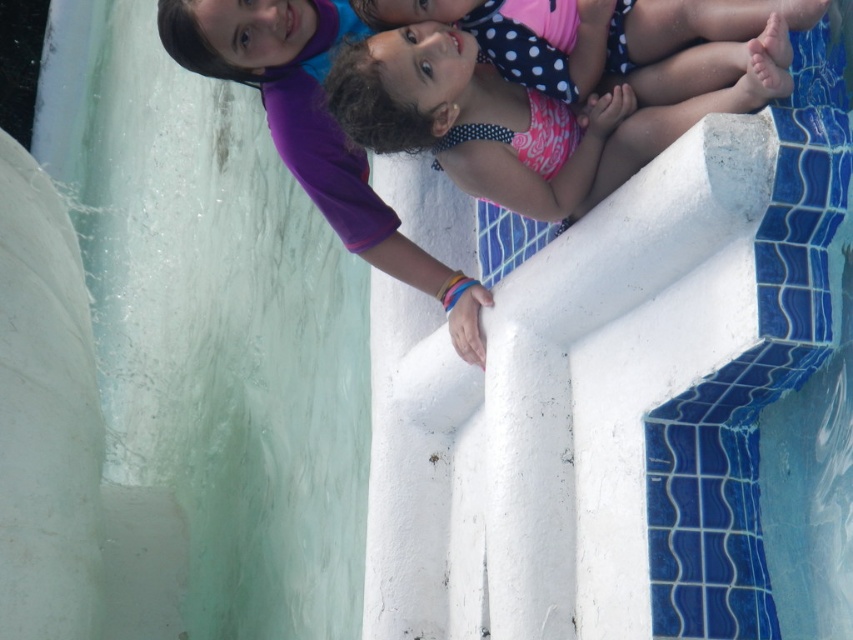
Is smooth white slide at left wider than pink polka dot swimsuit at center?

Incorrect, smooth white slide at left's width does not surpass pink polka dot swimsuit at center's.

Is point (62, 515) in front of point (428, 3)?

No, (62, 515) is further to viewer.

Find the location of `smooth white slide at left`. smooth white slide at left is located at coordinates (45, 413).

Looking at this image, does pink polka dot swimsuit at upper center have a smaller size compared to pink polka dot swimsuit at center?

No, pink polka dot swimsuit at upper center is not smaller than pink polka dot swimsuit at center.

Where is `pink polka dot swimsuit at upper center`? pink polka dot swimsuit at upper center is located at coordinates (538, 113).

Find the location of a particular element. The width and height of the screenshot is (853, 640). pink polka dot swimsuit at upper center is located at coordinates (538, 113).

Who is higher up, pink polka dot swimsuit at upper center or smooth white slide at left?

pink polka dot swimsuit at upper center is above.

Who is more forward, (463, 60) or (12, 321)?

Point (463, 60)

Which is behind, point (607, 134) or point (39, 474)?

The point (39, 474) is behind.

At what (x,y) coordinates should I click in order to perform the action: click on pink polka dot swimsuit at upper center. Please return your answer as a coordinate pair (x, y). This screenshot has width=853, height=640. Looking at the image, I should click on (538, 113).